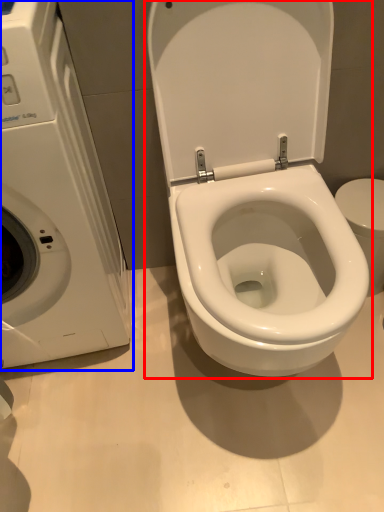
Question: Which object is closer to the camera taking this photo, toilet (highlighted by a red box) or washing machine (highlighted by a blue box)?

Choices:
 (A) toilet
 (B) washing machine

Answer: (B)